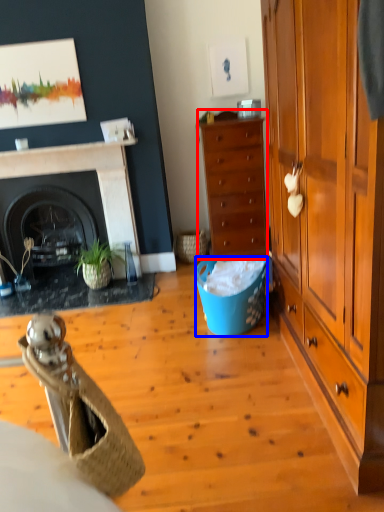
Question: Which of the following is the farthest to the observer, cabinet (highlighted by a red box) or trash bin/can (highlighted by a blue box)?

Choices:
 (A) cabinet
 (B) trash bin/can

Answer: (A)